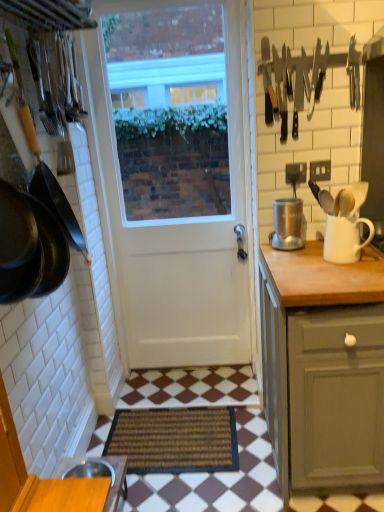
Identify the location of vacant point above matte gray cabinet at right (from a real-world perspective). (321, 265).